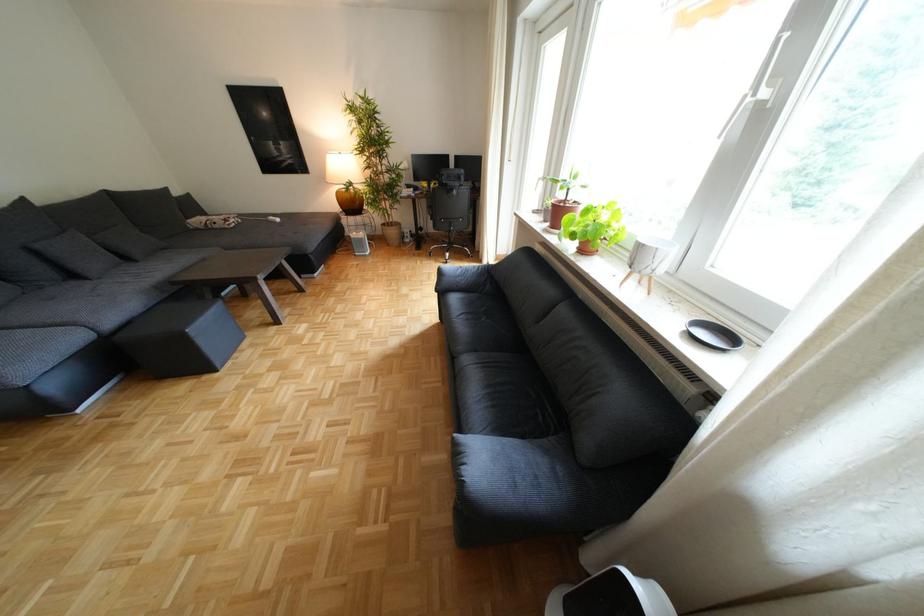
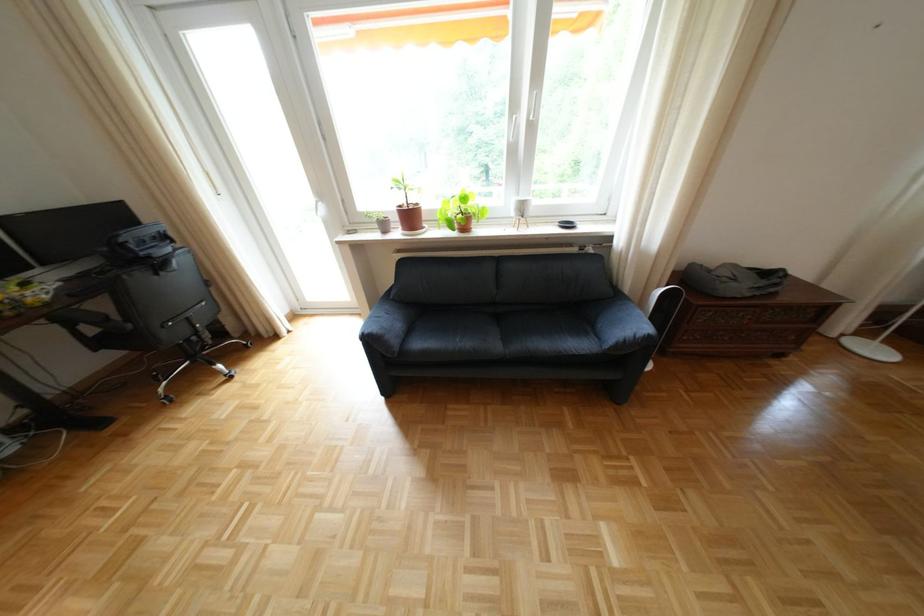
The point at (650, 585) is marked in the first image. Where is the corresponding point in the second image?

(682, 286)